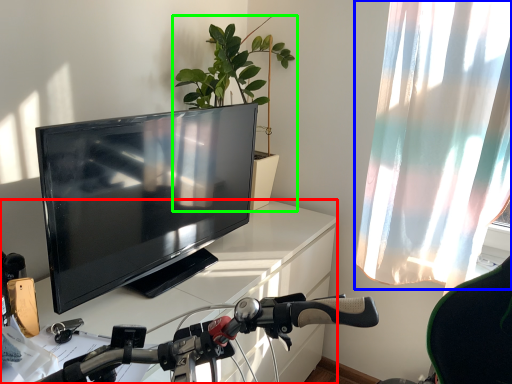
Question: Estimate the real-world distances between objects in this image. Which object is farther from desk (highlighted by a red box), curtain (highlighted by a blue box) or houseplant (highlighted by a green box)?

Choices:
 (A) curtain
 (B) houseplant

Answer: (A)